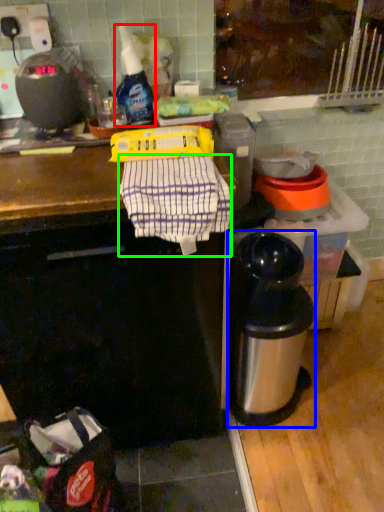
Question: Which object is positioned farthest from bottle (highlighted by a red box)? Select from appliance (highlighted by a blue box) and laundry (highlighted by a green box).

Choices:
 (A) appliance
 (B) laundry

Answer: (A)